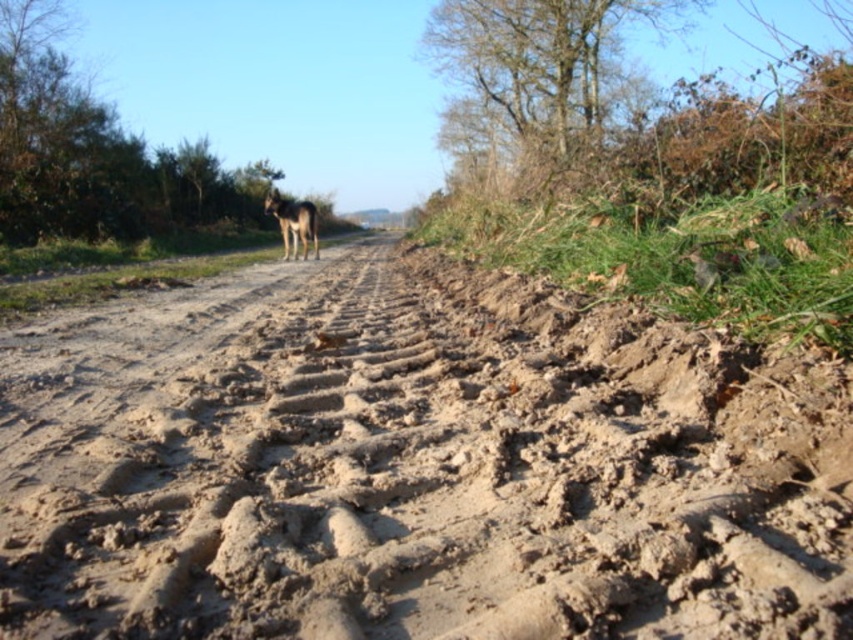
Does dry mud track at center have a greater height compared to brown fur dog at center?

No.

Who is taller, dry mud track at center or brown fur dog at center?

With more height is brown fur dog at center.

Is point (265, 472) more distant than point (294, 218)?

No, (265, 472) is in front of (294, 218).

Locate an element on the screen. This screenshot has height=640, width=853. dry mud track at center is located at coordinates (415, 465).